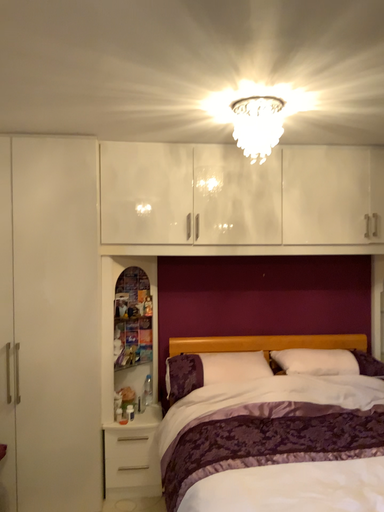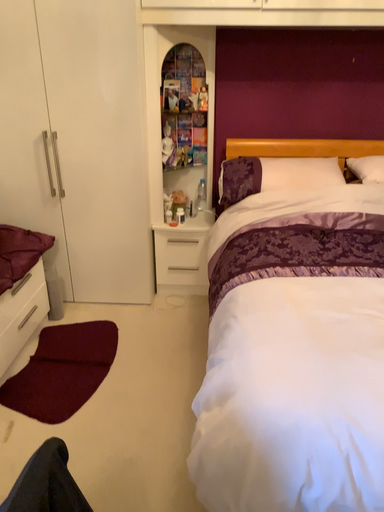
Question: How did the camera likely rotate when shooting the video?

Choices:
 (A) rotated right
 (B) rotated left

Answer: (B)